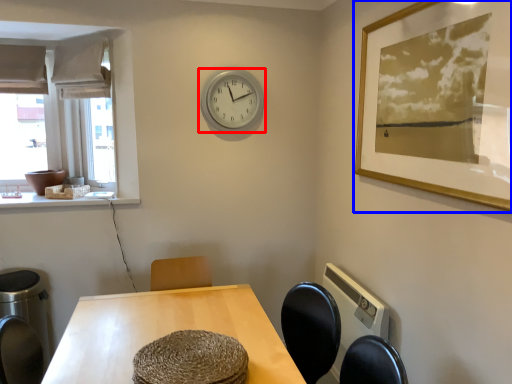
Question: Which object appears closest to the camera in this image, wall clock (highlighted by a red box) or picture frame (highlighted by a blue box)?

Choices:
 (A) wall clock
 (B) picture frame

Answer: (B)